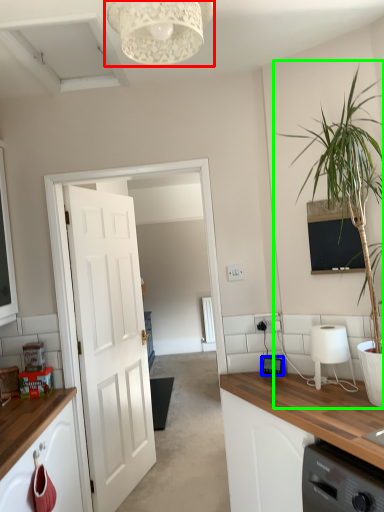
Question: Considering the real-world distances, which object is closest to light fixture (highlighted by a red box)? home appliance (highlighted by a blue box) or houseplant (highlighted by a green box).

Choices:
 (A) home appliance
 (B) houseplant

Answer: (B)